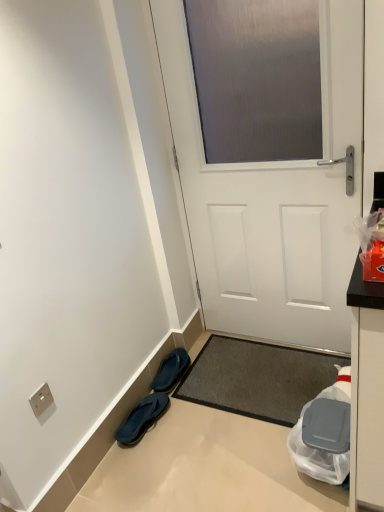
What are the coordinates of `vacant area that is in front of dark gray textured mat at center` in the screenshot? It's located at 235,460.